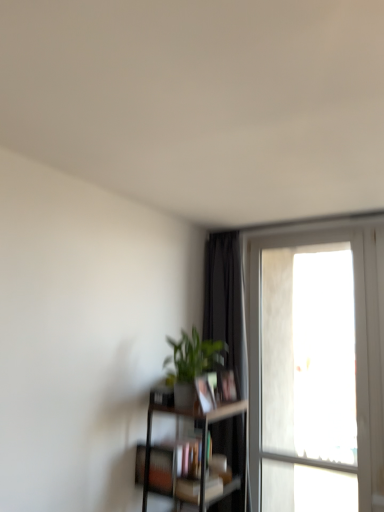
Question: Is hardcover book at center, arranged as the 3th book when ordered from the bottom, bigger than matte black bookshelf at lower center, positioned as the 3th book in top-to-bottom order?

Choices:
 (A) yes
 (B) no

Answer: (B)

Question: Can you confirm if hardcover book at center, arranged as the 3th book when ordered from the bottom, is shorter than matte black bookshelf at lower center, arranged as the 2th book when ordered from the bottom?

Choices:
 (A) no
 (B) yes

Answer: (B)

Question: Does hardcover book at center, arranged as the 3th book when ordered from the bottom, appear on the left side of matte black bookshelf at lower center, positioned as the 3th book in top-to-bottom order?

Choices:
 (A) yes
 (B) no

Answer: (B)

Question: Is hardcover book at center, the second book in the top-to-bottom sequence, located outside matte black bookshelf at lower center, positioned as the 3th book in top-to-bottom order?

Choices:
 (A) yes
 (B) no

Answer: (A)

Question: From the image's perspective, is hardcover book at center, arranged as the 3th book when ordered from the bottom, below matte black bookshelf at lower center, positioned as the 3th book in top-to-bottom order?

Choices:
 (A) yes
 (B) no

Answer: (B)

Question: Do you think matte black bookshelf at lower center, arranged as the 2th book when ordered from the bottom, is within dark brown wooden shelf at lower center, or outside of it?

Choices:
 (A) inside
 (B) outside

Answer: (A)

Question: Is point (193, 456) positioned closer to the camera than point (226, 407)?

Choices:
 (A) farther
 (B) closer

Answer: (B)

Question: From a real-world perspective, is matte black bookshelf at lower center, positioned as the 3th book in top-to-bottom order, positioned above or below dark brown wooden shelf at lower center?

Choices:
 (A) above
 (B) below

Answer: (A)

Question: Is matte black bookshelf at lower center, arranged as the 2th book when ordered from the bottom, wider or thinner than dark brown wooden shelf at lower center?

Choices:
 (A) wide
 (B) thin

Answer: (B)

Question: Which is correct: hardcover book at center, the second book in the top-to-bottom sequence, is inside matte black book at center, placed as the 1th book when sorted from top to bottom, or outside of it?

Choices:
 (A) inside
 (B) outside

Answer: (B)

Question: In terms of size, does hardcover book at center, the second book in the top-to-bottom sequence, appear bigger or smaller than matte black book at center, placed as the 1th book when sorted from top to bottom?

Choices:
 (A) small
 (B) big

Answer: (B)

Question: Considering their positions, is hardcover book at center, the second book in the top-to-bottom sequence, located in front of or behind matte black book at center, the 4th book when ordered from bottom to top?

Choices:
 (A) behind
 (B) front

Answer: (A)

Question: In terms of height, does hardcover book at center, arranged as the 3th book when ordered from the bottom, look taller or shorter compared to matte black book at center, the 4th book when ordered from bottom to top?

Choices:
 (A) tall
 (B) short

Answer: (A)

Question: Is point [x=367, y=367] positioned closer to the camera than point [x=196, y=377]?

Choices:
 (A) closer
 (B) farther

Answer: (B)

Question: Looking at the image, does clear glass window at right seem bigger or smaller compared to matte black book at center, the 4th book when ordered from bottom to top?

Choices:
 (A) big
 (B) small

Answer: (A)